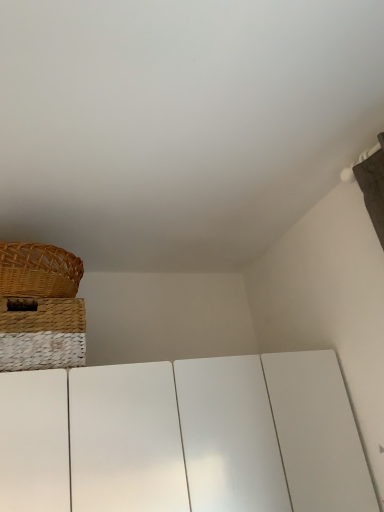
Question: Considering the relative sizes of woven straw basket at upper left and woven brown picnic basket at upper left in the image provided, is woven straw basket at upper left shorter than woven brown picnic basket at upper left?

Choices:
 (A) no
 (B) yes

Answer: (A)

Question: From the image's perspective, is woven straw basket at upper left under woven brown picnic basket at upper left?

Choices:
 (A) yes
 (B) no

Answer: (A)

Question: From the image's perspective, is woven straw basket at upper left located above woven brown picnic basket at upper left?

Choices:
 (A) yes
 (B) no

Answer: (B)

Question: Can you confirm if woven straw basket at upper left is smaller than woven brown picnic basket at upper left?

Choices:
 (A) yes
 (B) no

Answer: (B)

Question: Is woven straw basket at upper left at the left side of woven brown picnic basket at upper left?

Choices:
 (A) yes
 (B) no

Answer: (B)

Question: Is woven straw basket at upper left oriented away from woven brown picnic basket at upper left?

Choices:
 (A) yes
 (B) no

Answer: (B)

Question: Is woven brown picnic basket at upper left facing away from woven straw basket at upper left?

Choices:
 (A) no
 (B) yes

Answer: (A)

Question: From the image's perspective, is woven brown picnic basket at upper left above woven straw basket at upper left?

Choices:
 (A) yes
 (B) no

Answer: (A)

Question: Can you confirm if woven brown picnic basket at upper left is bigger than woven straw basket at upper left?

Choices:
 (A) no
 (B) yes

Answer: (A)

Question: Can you confirm if woven brown picnic basket at upper left is positioned to the right of woven straw basket at upper left?

Choices:
 (A) yes
 (B) no

Answer: (B)

Question: Can you confirm if woven brown picnic basket at upper left is shorter than woven straw basket at upper left?

Choices:
 (A) no
 (B) yes

Answer: (B)

Question: Considering the relative sizes of woven brown picnic basket at upper left and woven straw basket at upper left in the image provided, is woven brown picnic basket at upper left wider than woven straw basket at upper left?

Choices:
 (A) yes
 (B) no

Answer: (B)

Question: Would you say woven brown picnic basket at upper left is to the left or to the right of woven straw basket at upper left in the picture?

Choices:
 (A) left
 (B) right

Answer: (A)